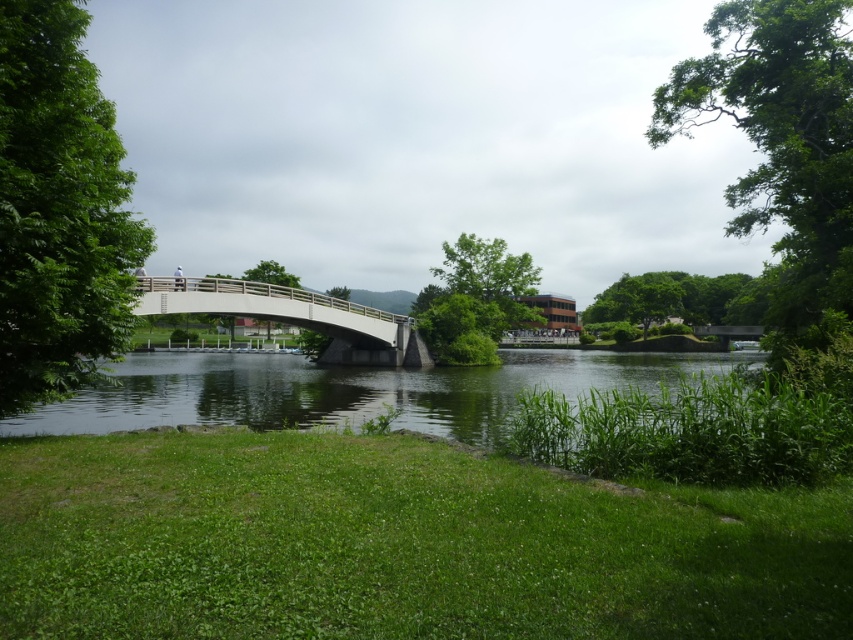
Question: Does green grassy lake at center appear under white concrete bridge at center?

Choices:
 (A) yes
 (B) no

Answer: (A)

Question: Which point is farther to the camera?

Choices:
 (A) green grassy lake at center
 (B) white concrete bridge at center

Answer: (B)

Question: Can you confirm if green grassy lake at center is smaller than white concrete bridge at center?

Choices:
 (A) no
 (B) yes

Answer: (A)

Question: Can you confirm if green grassy lake at center is bigger than white concrete bridge at center?

Choices:
 (A) yes
 (B) no

Answer: (A)

Question: Among these points, which one is farthest from the camera?

Choices:
 (A) (260, 317)
 (B) (86, 413)

Answer: (A)